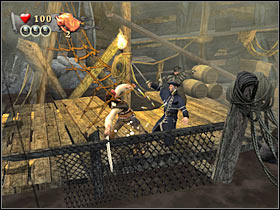
Image resolution: width=280 pixels, height=210 pixels. In order to click on light in this screenshot , I will do `click(122, 41)`.